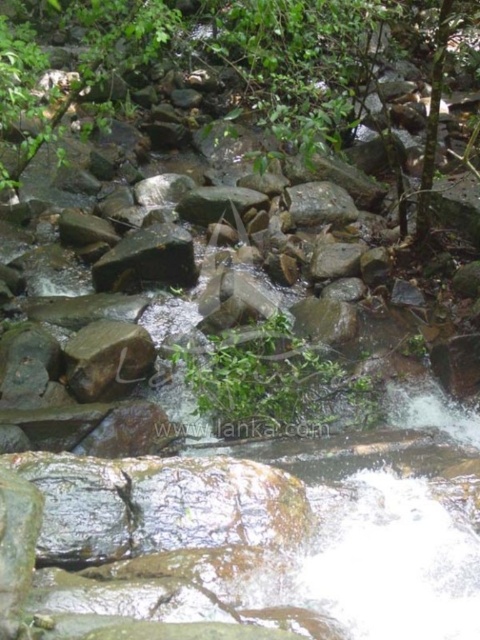
You are a hiker standing at the edge of the stream. You see a green leafy tree at center and a green mossy rock at center. Which object is closer to you?

The green leafy tree at center is closer to the viewer than the green mossy rock at center.

You are standing at the edge of the stream and see two points marked in the scene. The first point is at coordinates point (425, 157) and the second is at point (76, 384). Which point is closer to your current position?

Point (425, 157) is further to the viewer than point (76, 384), so the closer point to your current position is point (76, 384).

You are a hiker trying to cross the stream. You see a brown rough rock at center and a green mossy rock at center. Can you safely step from one to the other without getting your boots wet?

The distance between the brown rough rock at center and the green mossy rock at center is 10.26 feet, which is too far to jump across safely. You should look for closer rocks to avoid getting your boots wet.